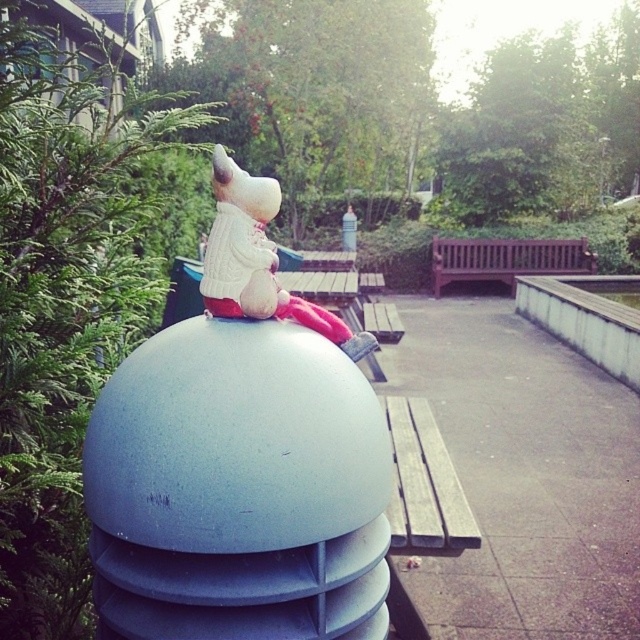
Question: Among these points, which one is farthest from the camera?

Choices:
 (A) (410, 493)
 (B) (260, 266)
 (C) (512, 257)

Answer: (C)

Question: Considering the real-world distances, which object is farthest from the brown wooden bench at center?

Choices:
 (A) wooden bench at right
 (B) white plush toy at center

Answer: (B)

Question: Can you confirm if wooden bench at right is positioned above brown wooden bench at center?

Choices:
 (A) no
 (B) yes

Answer: (A)

Question: Does white plush toy at center appear on the right side of brown wooden bench at center?

Choices:
 (A) no
 (B) yes

Answer: (A)

Question: Can you confirm if white plush toy at center is smaller than wooden bench at right?

Choices:
 (A) no
 (B) yes

Answer: (B)

Question: Which is nearer to the white plush toy at center?

Choices:
 (A) wooden bench at right
 (B) brown wooden bench at center

Answer: (A)